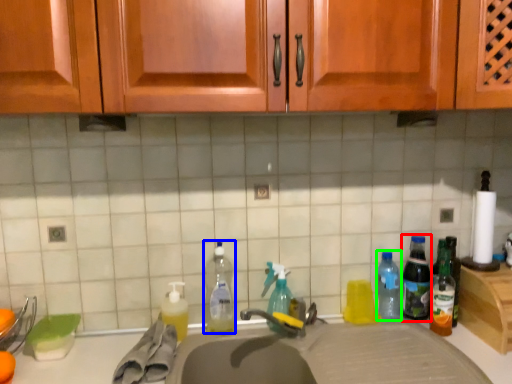
Question: Which object is positioned closest to bottle (highlighted by a red box)? Select from bottle (highlighted by a blue box) and bottle (highlighted by a green box).

Choices:
 (A) bottle
 (B) bottle

Answer: (B)